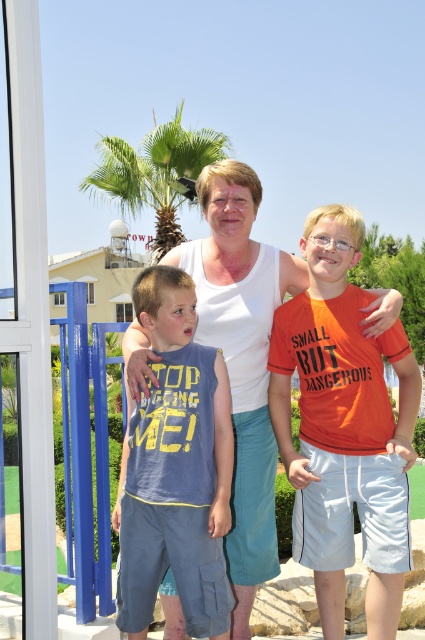
Question: Based on their relative distances, which object is nearer to the blue cotton shirt at center?

Choices:
 (A) white fabric at center
 (B) orange cotton t-shirt at center

Answer: (A)

Question: Which point is closer to the camera taking this photo?

Choices:
 (A) (226, 208)
 (B) (164, 314)

Answer: (B)

Question: Which is nearer to the blue cotton shirt at center?

Choices:
 (A) green leafy palm tree at upper center
 (B) orange cotton t-shirt at center
 (C) white fabric at center

Answer: (C)

Question: In this image, where is blue cotton shirt at center located relative to green leafy palm tree at upper center?

Choices:
 (A) left
 (B) right

Answer: (B)

Question: Is blue cotton shirt at center further to the viewer compared to white fabric at center?

Choices:
 (A) no
 (B) yes

Answer: (A)

Question: Is orange cotton t-shirt at center above blue cotton shirt at center?

Choices:
 (A) no
 (B) yes

Answer: (B)